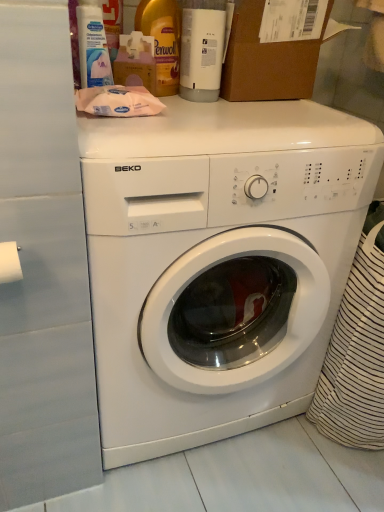
I want to click on vacant area that is in front of yellow plastic bottle at upper center, the 2th bottle from the right, so click(x=182, y=110).